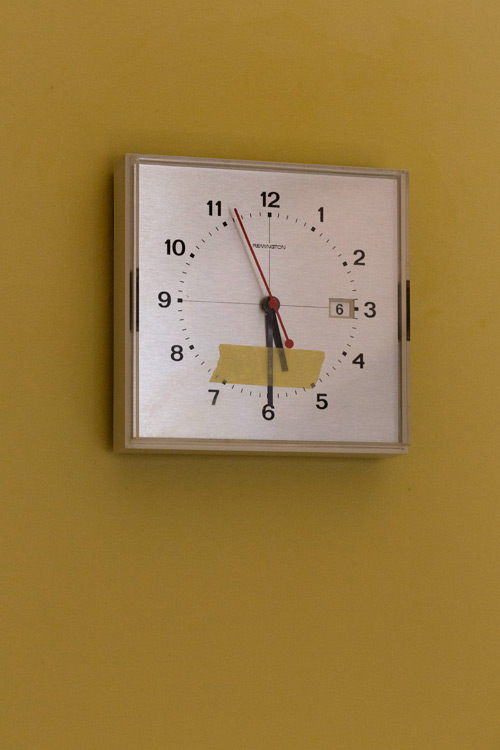
Locate an element on the screen. gold painted wall is located at coordinates (381, 574).